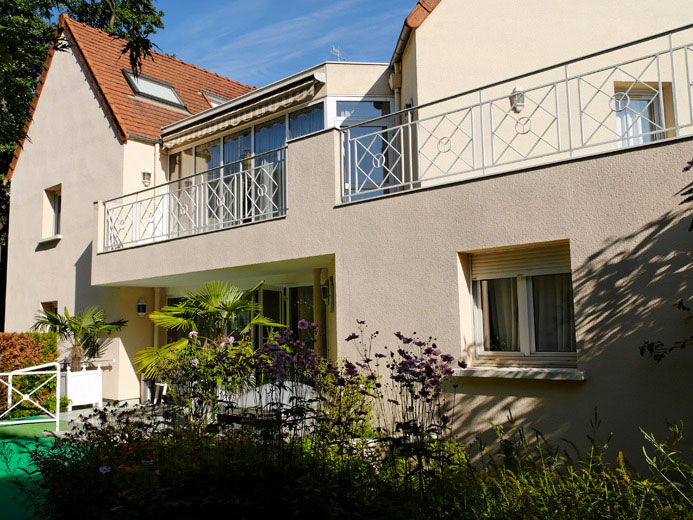
Identify the location of light. (141, 309).